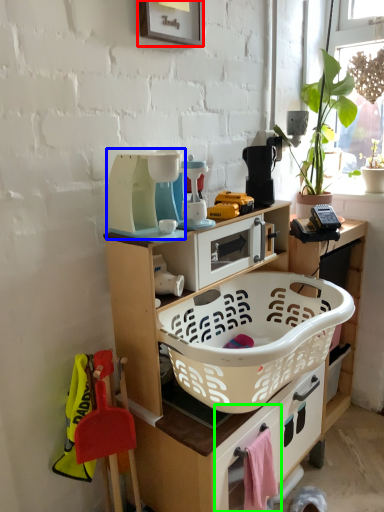
Question: Based on their relative distances, which object is farther from picture frame (highlighted by a red box)? Choose from appliance (highlighted by a blue box) and drawer (highlighted by a green box).

Choices:
 (A) appliance
 (B) drawer

Answer: (B)